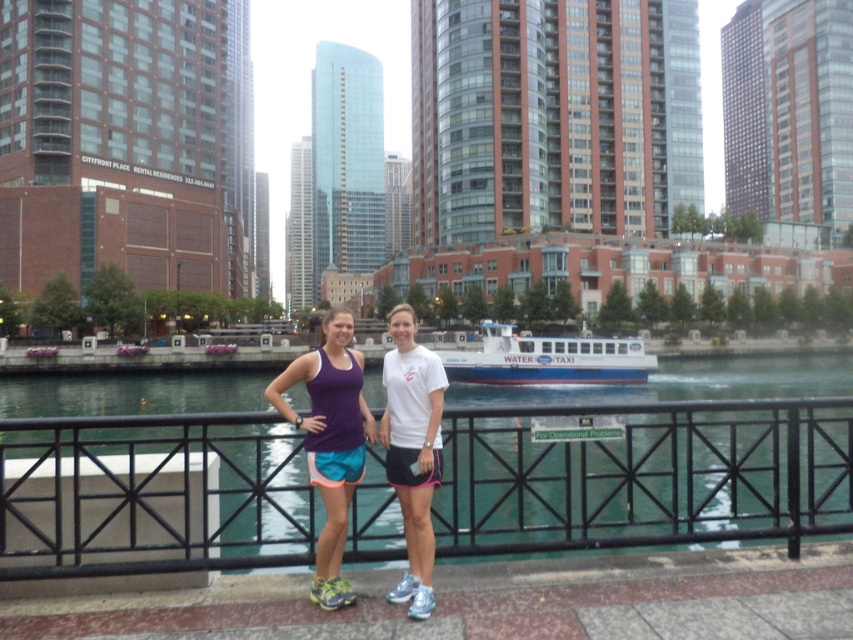
Question: Where is purple fabric tank top at center located in relation to white matte t-shirt at center in the image?

Choices:
 (A) above
 (B) below

Answer: (B)

Question: Can you confirm if white matte t-shirt at center is positioned to the right of white matte water taxi at center?

Choices:
 (A) yes
 (B) no

Answer: (B)

Question: Which point is closer to the camera taking this photo?

Choices:
 (A) (409, 365)
 (B) (329, 589)
 (C) (782, 432)
 (D) (604, 356)

Answer: (B)

Question: Which of the following is the closest to the observer?

Choices:
 (A) purple fabric tank top at center
 (B) white matte water taxi at center

Answer: (A)

Question: Can you confirm if purple fabric tank top at center is thinner than white matte water taxi at center?

Choices:
 (A) no
 (B) yes

Answer: (B)

Question: Which point is farther to the camera?

Choices:
 (A) purple fabric tank top at center
 (B) white matte t-shirt at center
 (C) black metal railing at center
 (D) white matte water taxi at center

Answer: (D)